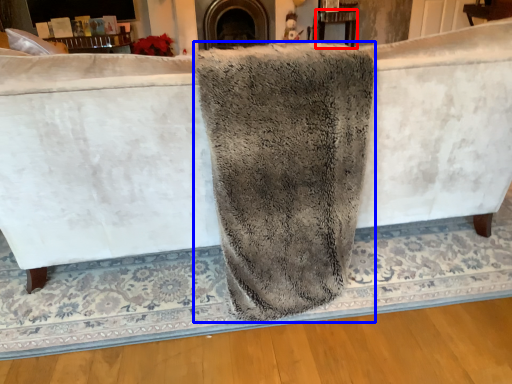
Question: Which of the following is the closest to the observer, table (highlighted by a red box) or bath towel (highlighted by a blue box)?

Choices:
 (A) table
 (B) bath towel

Answer: (B)